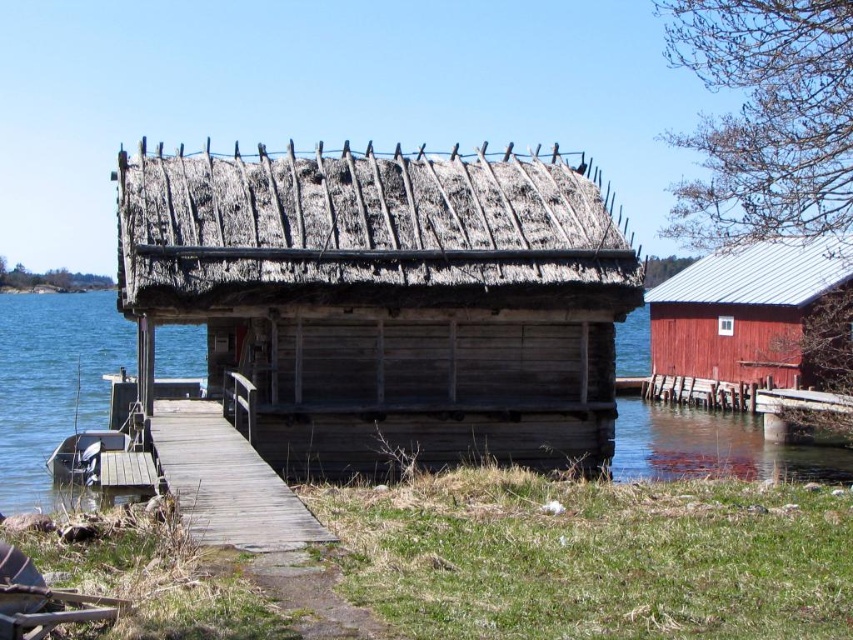
Does wooden thatched cabin at center have a lesser height compared to clear water at dock center?

Yes, wooden thatched cabin at center is shorter than clear water at dock center.

How distant is wooden thatched cabin at center from clear water at dock center?

They are 9.59 meters apart.

The width and height of the screenshot is (853, 640). What do you see at coordinates (386, 300) in the screenshot?
I see `wooden thatched cabin at center` at bounding box center [386, 300].

Find the location of a particular element. The width and height of the screenshot is (853, 640). wooden thatched cabin at center is located at coordinates (386, 300).

Between clear water at dock center and metallic red cabin at right, which one is positioned lower?

metallic red cabin at right is below.

Between clear water at dock center and metallic red cabin at right, which one has more height?

clear water at dock center is taller.

Which is behind, point (631, 404) or point (814, 268)?

Point (631, 404)

The image size is (853, 640). Identify the location of clear water at dock center. pos(51,381).

Which is behind, point (244, 196) or point (271, 509)?

Point (244, 196)

Identify the location of wooden thatched cabin at center. This screenshot has height=640, width=853. (386, 300).